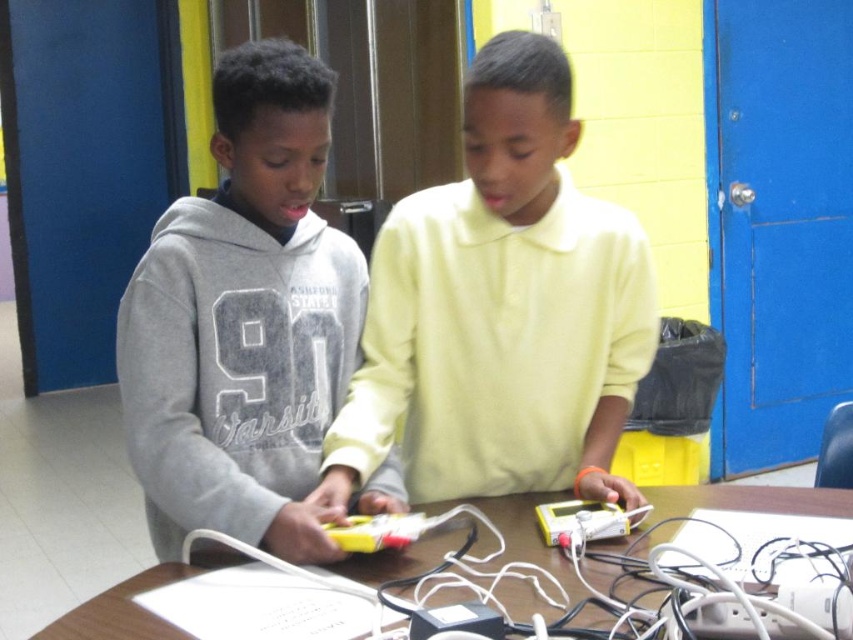
Based on the photo, is light yellow smooth shirt at center below gray matte hoodie at left?

Actually, light yellow smooth shirt at center is above gray matte hoodie at left.

Between light yellow smooth shirt at center and gray matte hoodie at left, which one is positioned lower?

gray matte hoodie at left

This screenshot has width=853, height=640. I want to click on light yellow smooth shirt at center, so click(502, 308).

Does gray matte hoodie at left have a lesser height compared to wooden table at center?

In fact, gray matte hoodie at left may be taller than wooden table at center.

Who is lower down, gray matte hoodie at left or wooden table at center?

wooden table at center is below.

Which is behind, point (230, 321) or point (415, 568)?

Point (230, 321)

Identify the location of gray matte hoodie at left. The height and width of the screenshot is (640, 853). (244, 321).

Can you confirm if light yellow smooth shirt at center is positioned above wooden table at center?

Correct, light yellow smooth shirt at center is located above wooden table at center.

Does point (614, 500) come closer to viewer compared to point (486, 540)?

No, (614, 500) is further to viewer.

Which is in front, point (537, 198) or point (506, 586)?

Point (506, 586) is more forward.

Locate an element on the screen. This screenshot has width=853, height=640. light yellow smooth shirt at center is located at coordinates (502, 308).